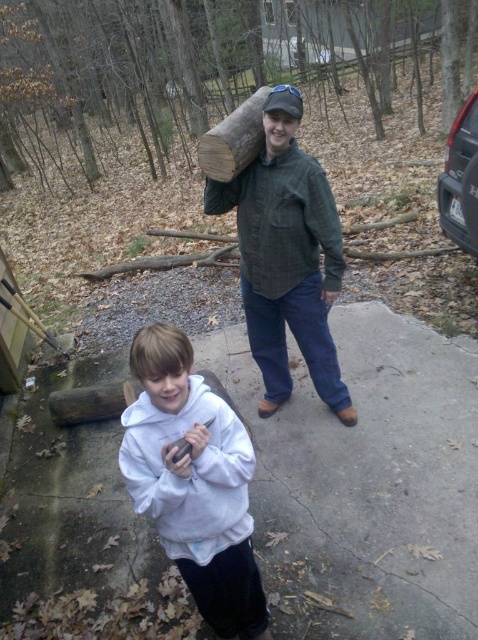
You are standing at the edge of the driveway and see the concrete at center and the white fleece hoodie at center. Which object is positioned to the right of the other?

The concrete at center is to the right of the white fleece hoodie at center.

You are trying to place a rectangular board that is 2 meters wide between the concrete at center and the green corduroy shirt at center. Based on their widths, can the board fit without overlapping either object?

The concrete at center might be wider than the green corduroy shirt at center. Since the board is 2 meters wide, it depends on the actual width of the concrete. If the concrete is indeed wider, then the board could potentially fit between them without overlapping, but if the concrete is narrower, it might not. However, since the description states the concrete might be wider, there is a possibility it can fit.

You are trying to determine which piece of clothing is smaller in size between the white fleece hoodie at center and the green corduroy shirt at center. Based on the scene description, which one takes up less visual space?

The white fleece hoodie at center occupies less space than the green corduroy shirt at center, so the white fleece hoodie at center is the smaller one in terms of visual size.